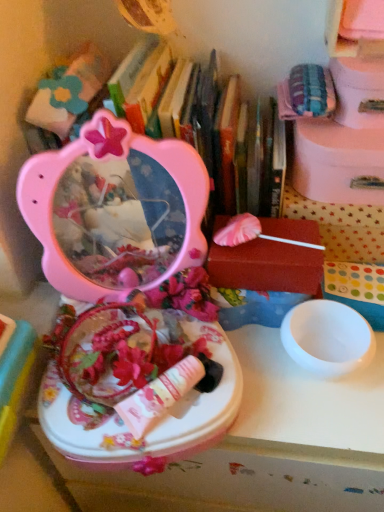
You are a GUI agent. You are given a task and a screenshot of the screen. Output one action in this format:
    pyautogui.click(x=<x>, y=<y>)
    Task: Click on the free space between matte pink vanity at center and white glossy bowl at right
    The height and width of the screenshot is (512, 384).
    Given the screenshot: What is the action you would take?
    pyautogui.click(x=267, y=391)